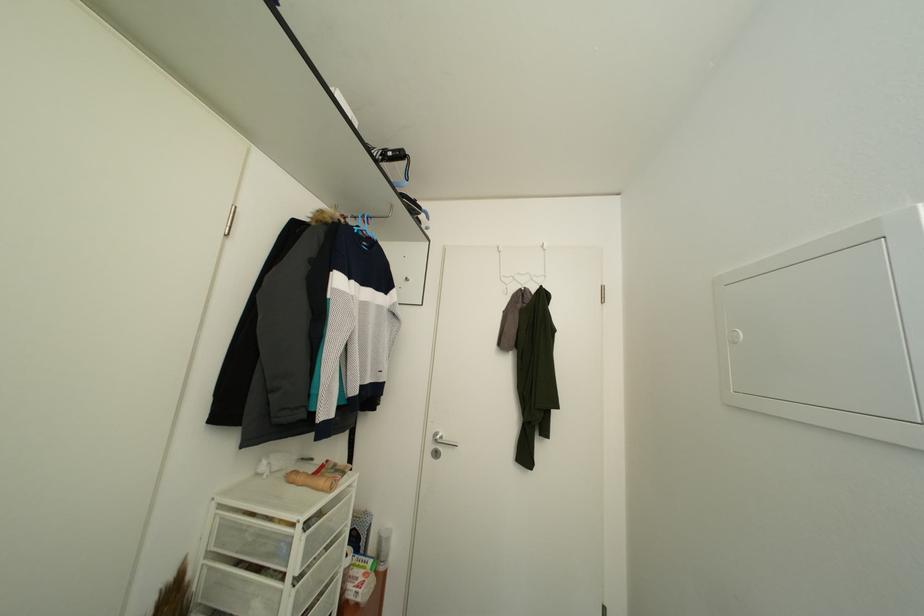
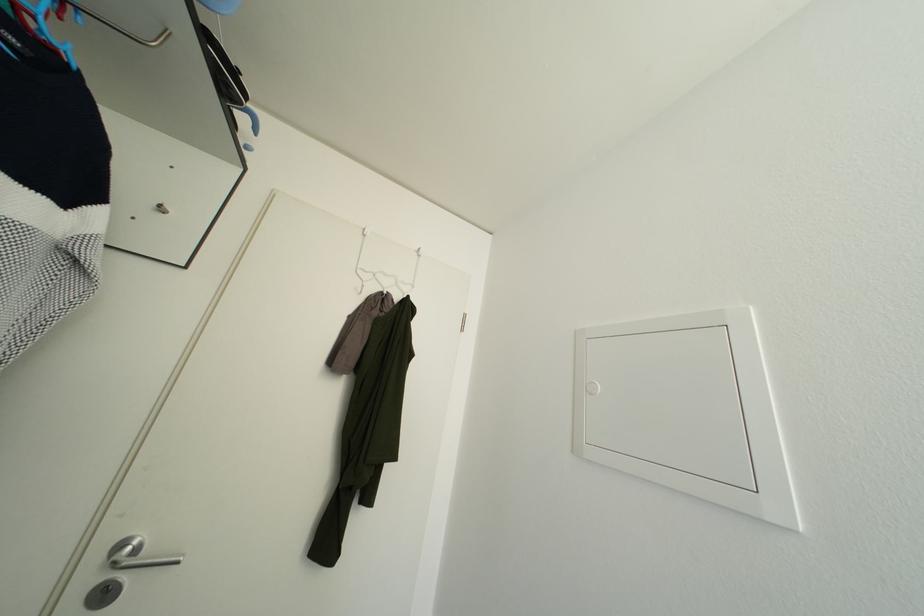
Find the pixel in the second image that matches the point at 508,284 in the first image.

(366, 277)